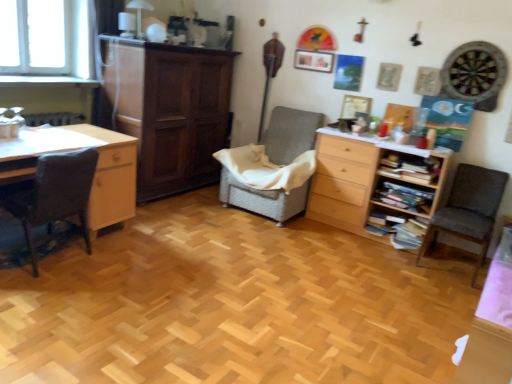
The height and width of the screenshot is (384, 512). Identify the location of free space in front of woven fabric chair at center, arranged as the 2th chair when viewed from the left. (262, 238).